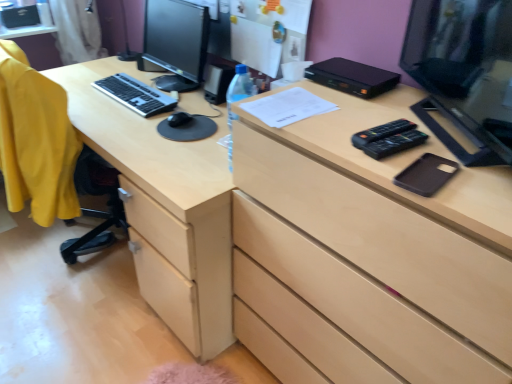
Locate an element on the screen. vacant area in front of white paper at center is located at coordinates (320, 129).